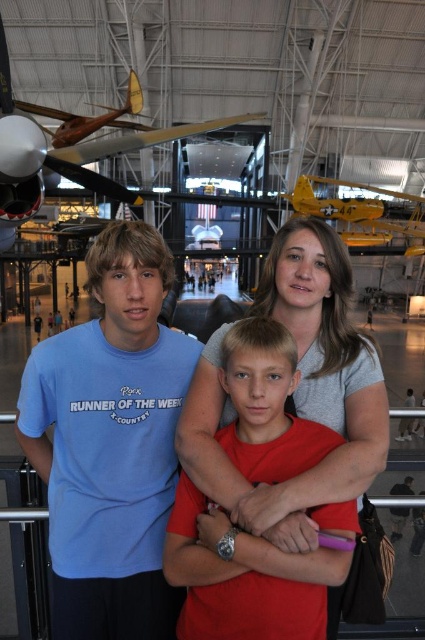
Between blue cotton t-shirt at left and matte red shirt at center, which one is positioned higher?

Positioned higher is blue cotton t-shirt at left.

From the picture: Is blue cotton t-shirt at left closer to the viewer compared to matte red shirt at center?

No, blue cotton t-shirt at left is behind matte red shirt at center.

The image size is (425, 640). What are the coordinates of `blue cotton t-shirt at left` in the screenshot? It's located at (110, 442).

Does matte red shirt at center have a lesser width compared to yellow matte airplane at upper center?

Indeed, matte red shirt at center has a lesser width compared to yellow matte airplane at upper center.

Which is behind, point (320, 429) or point (393, 234)?

Point (393, 234)

This screenshot has width=425, height=640. I want to click on matte red shirt at center, so click(243, 580).

Between blue cotton t-shirt at left and wooden propeller plane at upper left, which one is positioned higher?

wooden propeller plane at upper left is higher up.

Between blue cotton t-shirt at left and wooden propeller plane at upper left, which one is positioned lower?

Positioned lower is blue cotton t-shirt at left.

Which is behind, point (110, 388) or point (53, 166)?

Positioned behind is point (53, 166).

Image resolution: width=425 pixels, height=640 pixels. Find the location of `blue cotton t-shirt at left`. blue cotton t-shirt at left is located at coordinates (110, 442).